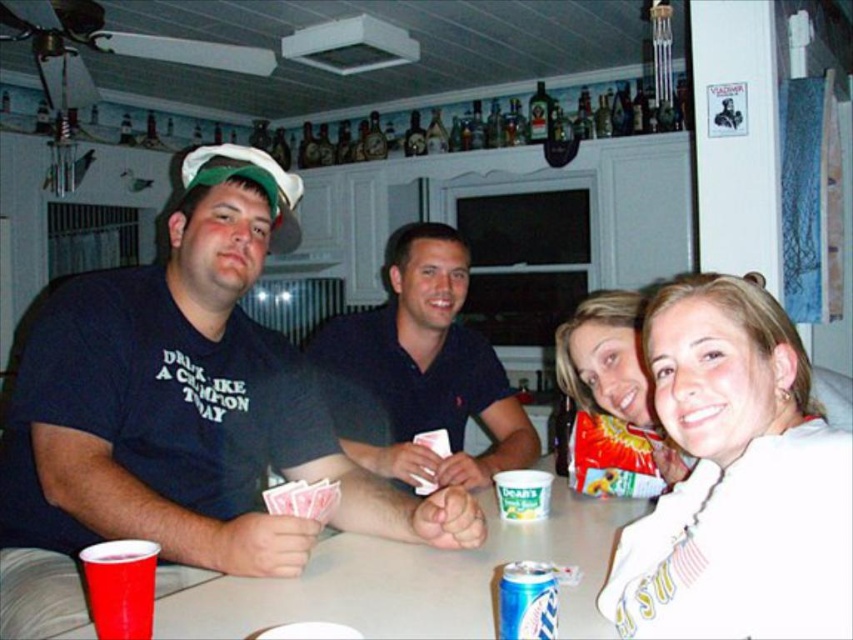
Question: Which of the following is the closest to the observer?

Choices:
 (A) (497, 595)
 (B) (358, 348)
 (C) (345, 564)

Answer: (A)

Question: Estimate the real-world distances between objects in this image. Which object is farther from the dark blue polo shirt at center?

Choices:
 (A) blue metallic can at lower center
 (B) white fleece sweatshirt at lower right

Answer: (B)

Question: Can you confirm if white fleece sweatshirt at lower right is wider than smooth plastic cup at lower left?

Choices:
 (A) no
 (B) yes

Answer: (A)

Question: Is smooth plastic cup at lower left thinner than smooth white shirt at lower right?

Choices:
 (A) no
 (B) yes

Answer: (A)

Question: Which of these objects is positioned farthest from the dark blue polo shirt at center?

Choices:
 (A) smooth white shirt at lower right
 (B) smooth plastic cup at lower left
 (C) white fleece sweatshirt at lower right

Answer: (C)

Question: Does matte black shirt at left appear over white fleece sweatshirt at lower right?

Choices:
 (A) yes
 (B) no

Answer: (A)